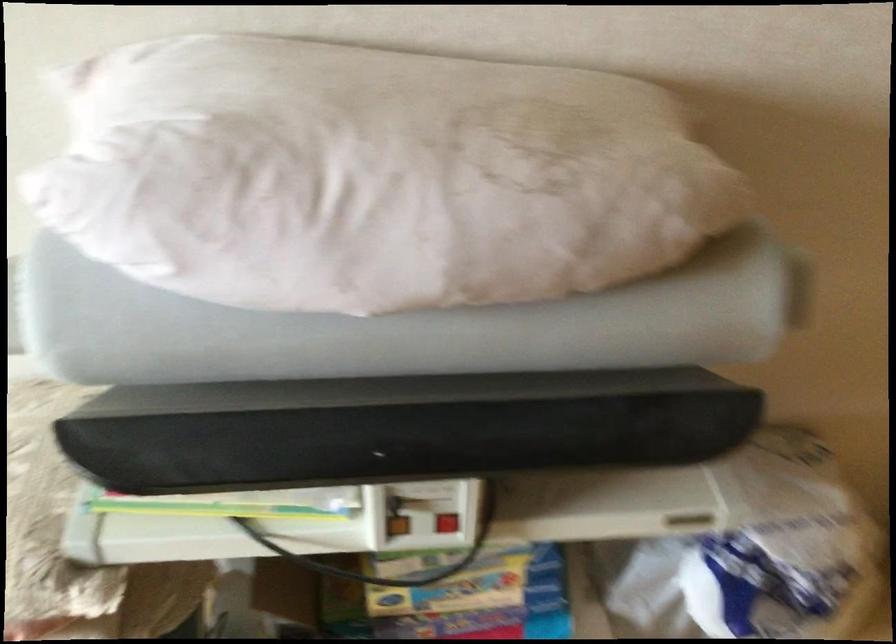
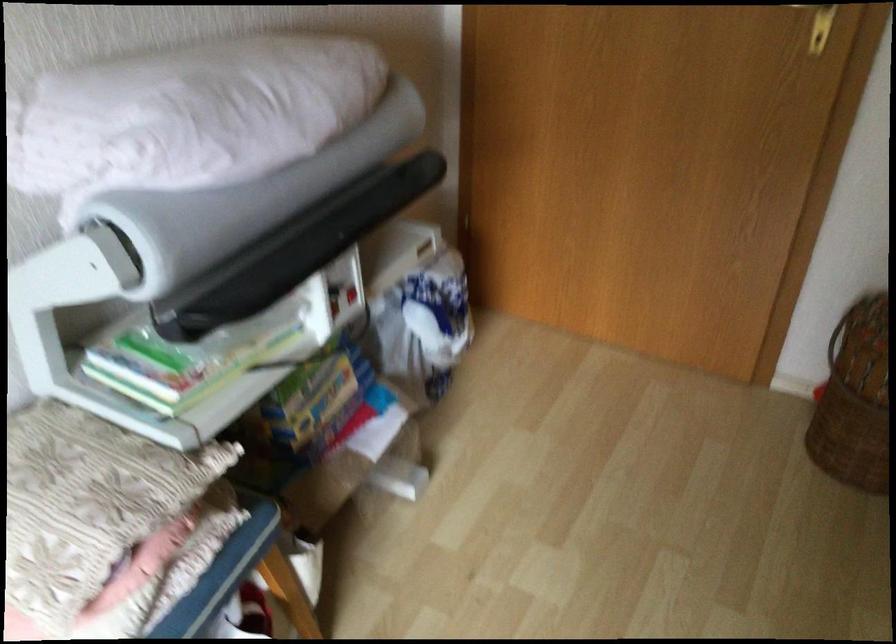
Locate, in the second image, the point that corresponds to point 332,424 in the first image.

(295, 249)